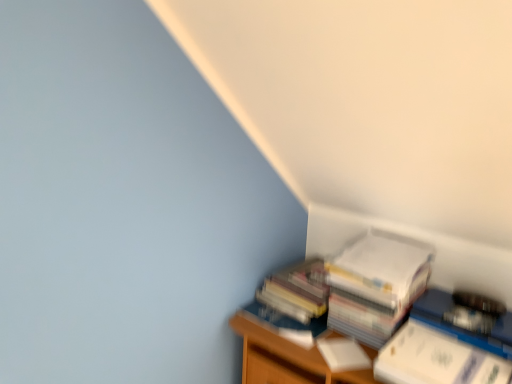
Where is `blank space situated above white paper at right, the 3th paperback book in the back-to-front sequence (from a real-world perspective)`? The height and width of the screenshot is (384, 512). blank space situated above white paper at right, the 3th paperback book in the back-to-front sequence (from a real-world perspective) is located at coordinates (448, 357).